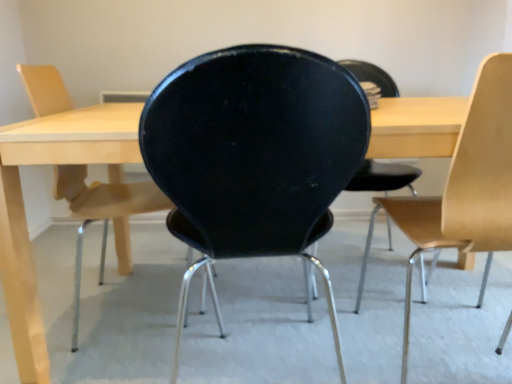
The width and height of the screenshot is (512, 384). In order to click on matte black chair at center, marked as the third chair in a right-to-left arrangement in this screenshot , I will do `click(106, 203)`.

I want to click on black matte chair at center, which ranks as the second chair in left-to-right order, so click(x=255, y=151).

What is the approximate height of light wood/wooden chair at right, the first chair from the right?

light wood/wooden chair at right, the first chair from the right, is 34.53 inches tall.

The image size is (512, 384). Find the location of `matte black chair at center, which appears as the 1th chair when viewed from the left`. matte black chair at center, which appears as the 1th chair when viewed from the left is located at coordinates (106, 203).

Which object is thinner, light wood/wooden chair at right, the first chair from the right, or black matte chair at center, which ranks as the second chair in left-to-right order?

black matte chair at center, which ranks as the second chair in left-to-right order, is thinner.

Is light wood/wooden chair at right, the first chair from the right, bigger or smaller than black matte chair at center, which ranks as the second chair in left-to-right order?

light wood/wooden chair at right, the first chair from the right, is bigger than black matte chair at center, which ranks as the second chair in left-to-right order.

From the picture: From the image's perspective, is light wood/wooden chair at right, the first chair from the right, positioned above or below black matte chair at center, which ranks as the second chair in left-to-right order?

Clearly, from the image's perspective, light wood/wooden chair at right, the first chair from the right, is above black matte chair at center, which ranks as the second chair in left-to-right order.

How far apart are light wood/wooden chair at right, the first chair from the right, and black matte chair at center, which ranks as the second chair in left-to-right order?

light wood/wooden chair at right, the first chair from the right, is 15.88 inches from black matte chair at center, which ranks as the second chair in left-to-right order.

Does point (492, 170) come closer to viewer compared to point (100, 277)?

Yes, it is in front of point (100, 277).

Based on their sizes in the image, would you say light wood/wooden chair at right, the first chair from the right, is bigger or smaller than matte black chair at center, which appears as the 1th chair when viewed from the left?

Clearly, light wood/wooden chair at right, the first chair from the right, is larger in size than matte black chair at center, which appears as the 1th chair when viewed from the left.

From a real-world perspective, between light wood/wooden chair at right, the first chair from the right, and matte black chair at center, marked as the third chair in a right-to-left arrangement, who is vertically higher?

light wood/wooden chair at right, the first chair from the right, from a real-world perspective.

Considering the sizes of matte black chair at center, which appears as the 1th chair when viewed from the left, and light wood/wooden chair at right, the first chair from the right, in the image, is matte black chair at center, which appears as the 1th chair when viewed from the left, taller or shorter than light wood/wooden chair at right, the first chair from the right,?

matte black chair at center, which appears as the 1th chair when viewed from the left, is shorter than light wood/wooden chair at right, the first chair from the right.

Which of these two, matte black chair at center, which appears as the 1th chair when viewed from the left, or light wood/wooden chair at right, the 3th chair from the left, is thinner?

Thinner between the two is matte black chair at center, which appears as the 1th chair when viewed from the left.

Can you confirm if matte black chair at center, marked as the third chair in a right-to-left arrangement, is smaller than light wood/wooden chair at right, the first chair from the right?

Correct, matte black chair at center, marked as the third chair in a right-to-left arrangement, occupies less space than light wood/wooden chair at right, the first chair from the right.

Do you think matte black chair at center, which appears as the 1th chair when viewed from the left, is within light wood/wooden chair at right, the 3th chair from the left, or outside of it?

matte black chair at center, which appears as the 1th chair when viewed from the left, is not enclosed by light wood/wooden chair at right, the 3th chair from the left.

Considering the sizes of objects matte black chair at center, marked as the third chair in a right-to-left arrangement, and black matte chair at center, which ranks as the second chair in left-to-right order, in the image provided, who is thinner, matte black chair at center, marked as the third chair in a right-to-left arrangement, or black matte chair at center, which ranks as the second chair in left-to-right order,?

With smaller width is matte black chair at center, marked as the third chair in a right-to-left arrangement.

The height and width of the screenshot is (384, 512). What are the coordinates of `chair that is the 2nd object directly below the black matte chair at center, the second chair in the right-to-left sequence (from a real-world perspective)` in the screenshot? It's located at (106, 203).

Does matte black chair at center, which appears as the 1th chair when viewed from the left, lie behind black matte chair at center, which ranks as the second chair in left-to-right order?

Yes, it is.

Is black matte chair at center, which ranks as the second chair in left-to-right order, positioned far away from matte black chair at center, marked as the third chair in a right-to-left arrangement?

Actually, black matte chair at center, which ranks as the second chair in left-to-right order, and matte black chair at center, marked as the third chair in a right-to-left arrangement, are a little close together.

Is black matte chair at center, which ranks as the second chair in left-to-right order, aimed at matte black chair at center, marked as the third chair in a right-to-left arrangement?

No, black matte chair at center, which ranks as the second chair in left-to-right order, is not turned towards matte black chair at center, marked as the third chair in a right-to-left arrangement.

Is black matte chair at center, which ranks as the second chair in left-to-right order, positioned behind matte black chair at center, which appears as the 1th chair when viewed from the left?

No, it is not.

Which of these two, black matte chair at center, which ranks as the second chair in left-to-right order, or matte black chair at center, which appears as the 1th chair when viewed from the left, is wider?

black matte chair at center, which ranks as the second chair in left-to-right order, is wider.

In the scene shown: Is black matte chair at center, which ranks as the second chair in left-to-right order, next to light wood/wooden chair at right, the first chair from the right?

They are not placed beside each other.

Is point (274, 217) closer to viewer compared to point (495, 91)?

No, (274, 217) is further to viewer.

At what (x,y) coordinates should I click in order to perform the action: click on chair that is the 1st object located behind the black matte chair at center, the second chair in the right-to-left sequence. Please return your answer as a coordinate pair (x, y). Image resolution: width=512 pixels, height=384 pixels. Looking at the image, I should click on (464, 187).

Starting from the matte black chair at center, marked as the third chair in a right-to-left arrangement, which chair is the 1st one in front? Please provide its 2D coordinates.

[(464, 187)]

Based on their spatial positions, is black matte chair at center, the second chair in the right-to-left sequence, or matte black chair at center, which appears as the 1th chair when viewed from the left, closer to light wood/wooden chair at right, the first chair from the right?

black matte chair at center, the second chair in the right-to-left sequence, is positioned closer to the anchor light wood/wooden chair at right, the first chair from the right.

When comparing their distances from light wood/wooden chair at right, the first chair from the right, does matte black chair at center, which appears as the 1th chair when viewed from the left, or black matte chair at center, which ranks as the second chair in left-to-right order, seem closer?

black matte chair at center, which ranks as the second chair in left-to-right order, is positioned closer to the anchor light wood/wooden chair at right, the first chair from the right.

Which object lies further to the anchor point black matte chair at center, which ranks as the second chair in left-to-right order, matte black chair at center, marked as the third chair in a right-to-left arrangement, or light wood/wooden chair at right, the 3th chair from the left?

matte black chair at center, marked as the third chair in a right-to-left arrangement, lies further to black matte chair at center, which ranks as the second chair in left-to-right order, than the other object.

When comparing their distances from matte black chair at center, which appears as the 1th chair when viewed from the left, does light wood/wooden chair at right, the 3th chair from the left, or black matte chair at center, which ranks as the second chair in left-to-right order, seem closer?

Based on the image, black matte chair at center, which ranks as the second chair in left-to-right order, appears to be nearer to matte black chair at center, which appears as the 1th chair when viewed from the left.

Considering their positions, is black matte chair at center, the second chair in the right-to-left sequence, positioned closer to matte black chair at center, which appears as the 1th chair when viewed from the left, than light wood/wooden chair at right, the 3th chair from the left?

black matte chair at center, the second chair in the right-to-left sequence, is positioned closer to the anchor matte black chair at center, which appears as the 1th chair when viewed from the left.

Which object lies further to the anchor point black matte chair at center, the second chair in the right-to-left sequence, light wood/wooden chair at right, the 3th chair from the left, or matte black chair at center, which appears as the 1th chair when viewed from the left?

Among the two, matte black chair at center, which appears as the 1th chair when viewed from the left, is located further to black matte chair at center, the second chair in the right-to-left sequence.

The width and height of the screenshot is (512, 384). In order to click on chair between matte black chair at center, which appears as the 1th chair when viewed from the left, and light wood/wooden chair at right, the first chair from the right, in the horizontal direction in this screenshot , I will do `click(255, 151)`.